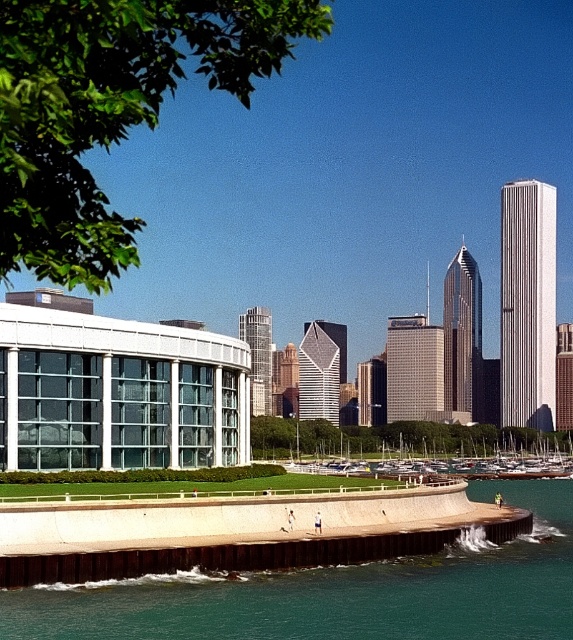
You are standing at the point marked by the coordinates point [339,593]. What object are you directly in front of?

The teal concrete wall at lower center is located at point [339,593], so you are directly in front of the teal concrete wall at lower center.

You are standing at the waterfront and see the teal concrete wall at lower center and the white wooden boats at center. Which object is positioned higher relative to the other?

The teal concrete wall at lower center is positioned above the white wooden boats at center, making it higher in elevation.